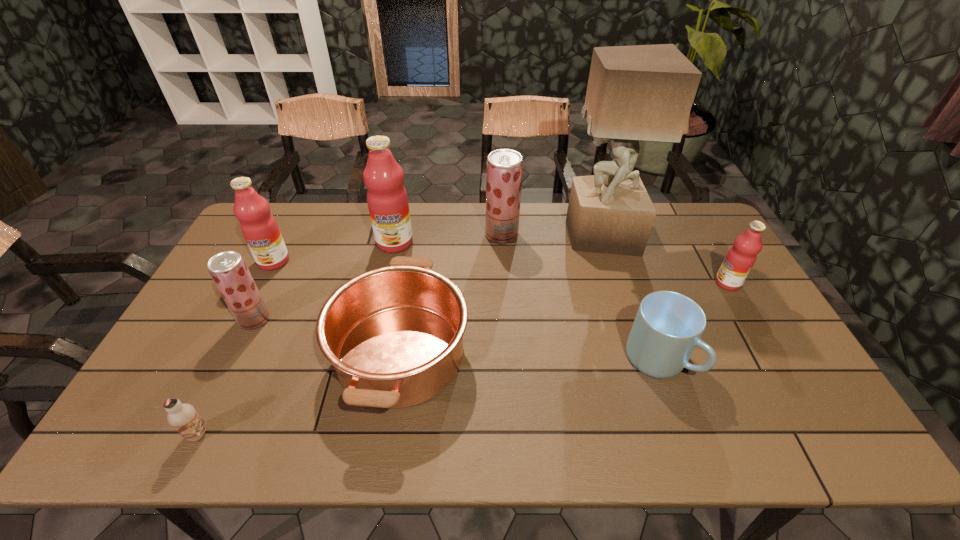
I want to click on vacant position in the image that satisfies the following two spatial constraints: 1. on the front-facing side of the sculpture; 2. on the label of the tallest fruit juice, so click(x=602, y=242).

Find the location of `free spot that satisfies the following two spatial constraints: 1. on the label of the second smallest pink fruit juice; 2. on the left side of the chocolate milk`. free spot that satisfies the following two spatial constraints: 1. on the label of the second smallest pink fruit juice; 2. on the left side of the chocolate milk is located at coordinates (187, 434).

What are the coordinates of `free space that satisfies the following two spatial constraints: 1. on the label of the mug; 2. on the left side of the tallest fruit juice` in the screenshot? It's located at (370, 360).

Locate an element on the screen. vacant region that satisfies the following two spatial constraints: 1. on the front-facing side of the mug; 2. on the left side of the gray sculpture is located at coordinates (638, 360).